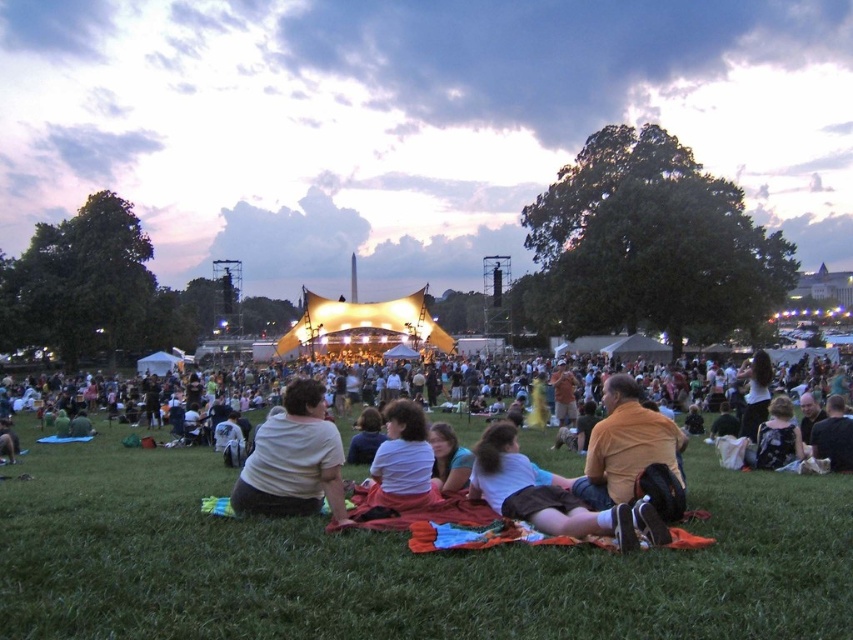
You are standing in the park and see two points in the scene. The first point is at coordinates point (405, 496) and the second is at point (759, 449). Which point is closer to you?

Point (405, 496) is closer to the viewer than point (759, 449).

You are a photographer at the event and want to capture a photo of both the orange cotton shirt at lower center and the orange cotton shirt at center. Which shirt should you focus on first if you want to include both in your frame without zooming in or out?

The orange cotton shirt at lower center has a larger width than the orange cotton shirt at center, so focusing on it first would allow you to adjust your frame to include both shirts without needing to zoom.

From the picture: Please provide the 2D coordinates of the orange cotton shirt at lower center in the image.

The orange cotton shirt at lower center is located at coordinates (550, 497).